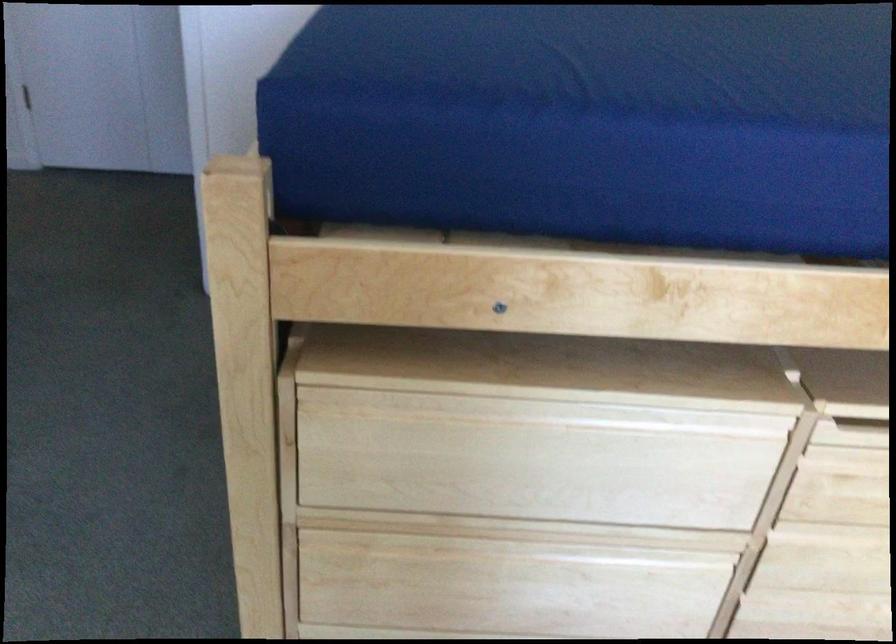
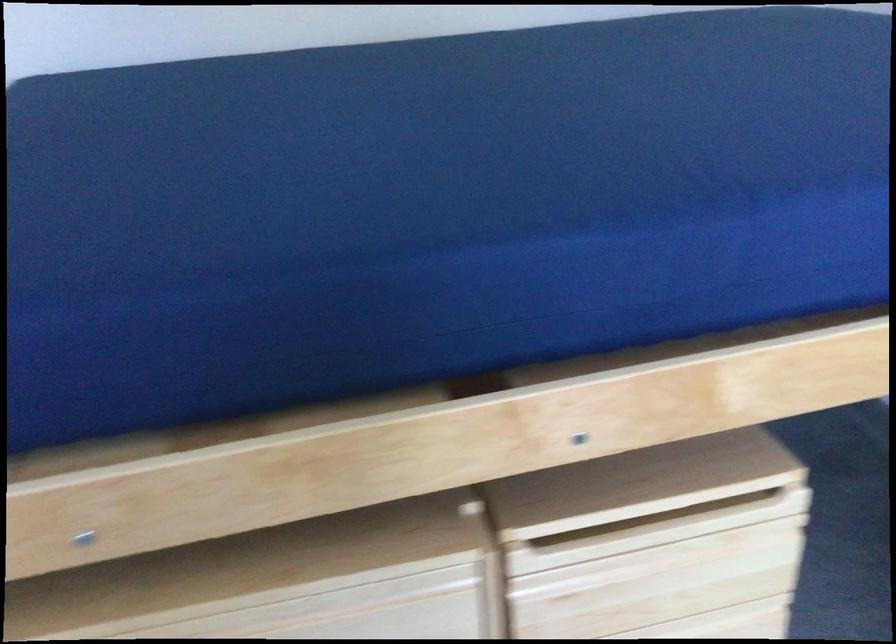
In the second image, find the point that corresponds to point (821, 95) in the first image.

(431, 210)